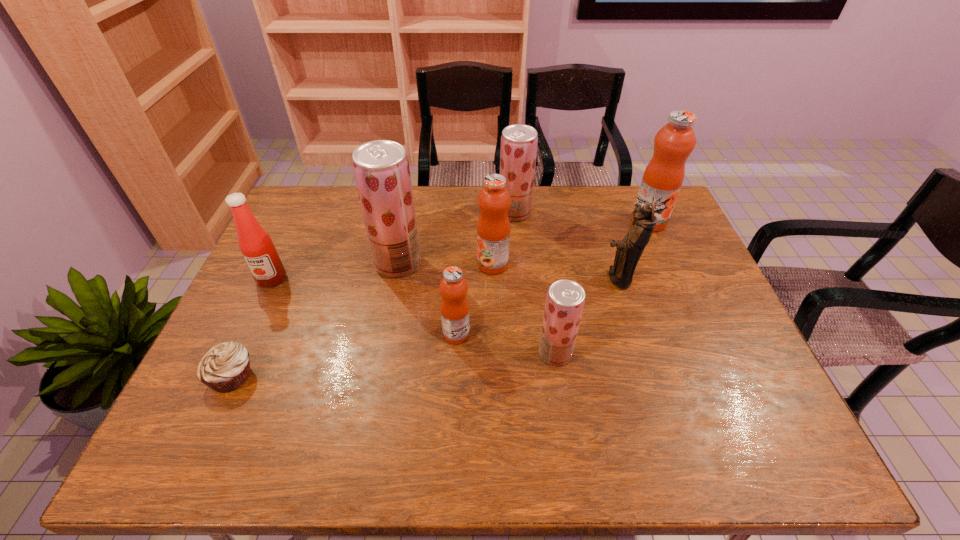
This screenshot has height=540, width=960. In order to click on free location located on the front-facing side of the second object from right to left in this screenshot , I will do `click(567, 278)`.

Identify the location of free space located on the front-facing side of the second object from right to left. (514, 278).

The width and height of the screenshot is (960, 540). I want to click on free space located on the front-facing side of the red condiment, so click(228, 373).

Image resolution: width=960 pixels, height=540 pixels. What are the coordinates of `free location located on the back of the nearest strawberry fruit juice` in the screenshot? It's located at (547, 296).

Locate an element on the screen. The width and height of the screenshot is (960, 540). vacant space located on the front label of the nearest orange fruit juice is located at coordinates (604, 334).

This screenshot has height=540, width=960. In order to click on free space located on the back of the muffin in this screenshot , I will do `click(281, 268)`.

Identify the location of condiment present at the left edge. The height and width of the screenshot is (540, 960). (256, 245).

At what (x,y) coordinates should I click in order to perform the action: click on muffin at the left edge. Please return your answer as a coordinate pair (x, y). The image size is (960, 540). Looking at the image, I should click on (224, 368).

The image size is (960, 540). What are the coordinates of `object at the right edge` in the screenshot? It's located at (663, 177).

Identify the location of object located in the far right corner section of the desktop. The image size is (960, 540). (663, 177).